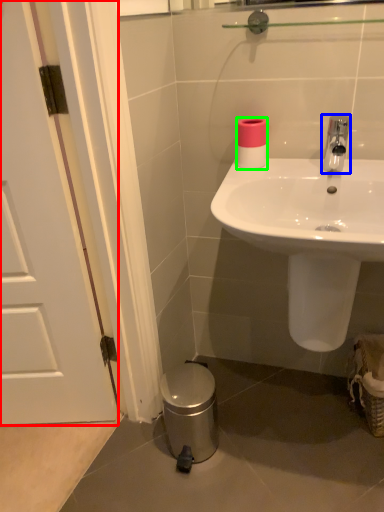
Question: Which object is positioned farthest from door (highlighted by a red box)? Select from tap (highlighted by a blue box) and toilet paper (highlighted by a green box).

Choices:
 (A) tap
 (B) toilet paper

Answer: (A)